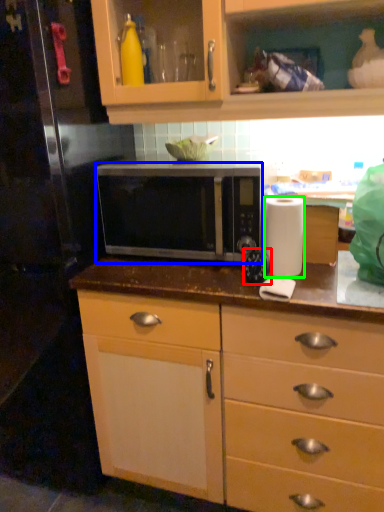
Question: Which object is positioned farthest from appliance (highlighted by a red box)? Select from microwave oven (highlighted by a blue box) and paper towel (highlighted by a green box).

Choices:
 (A) microwave oven
 (B) paper towel

Answer: (A)